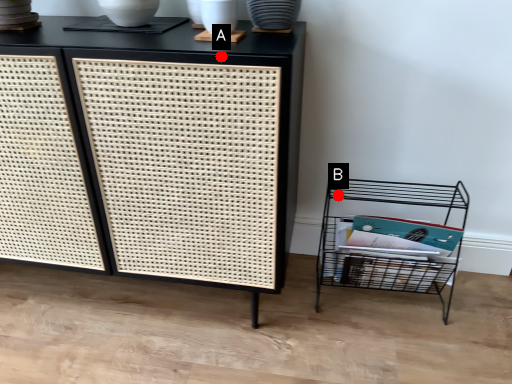
Question: Two points are circled on the image, labeled by A and B beside each circle. Which point is closer to the camera?

Choices:
 (A) A is closer
 (B) B is closer

Answer: (A)